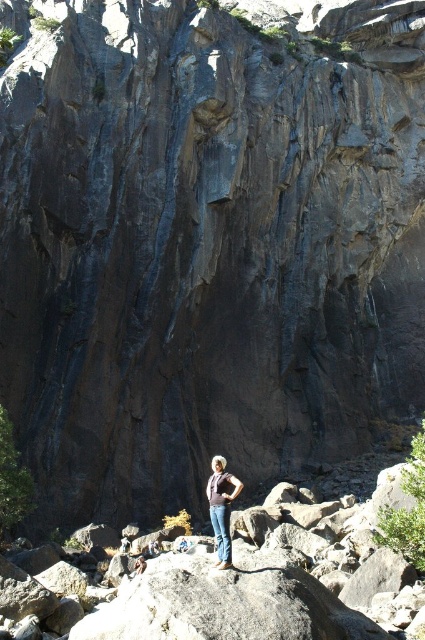
You are standing at the base of the towering rock face and want to find the point on the cliff that corresponds to the coordinates given. Which part of the cliff would the point at coordinates point (221, 508) be located?

The point at coordinates point (221, 508) is located on the denim pants at center, which belongs to the person standing on the rocks in the foreground.

Consider the image. You are a hiker who wants to ensure your clothing is properly layered before ascending the rocky terrain near the towering rock face. Are your denim pants at center covering your denim jeans at center?

The denim pants at center is positioned over denim jeans at center, so yes, the denim pants at center are covering the denim jeans at center.

You are a photographer trying to capture the entire scene of the towering rock face. You notice two objects labeled denim pants at center and denim jeans at center in the foreground. Which one should you adjust your camera angle to include both while maintaining the cliff as the main focus?

Since the denim pants at center is to the right of denim jeans at center, you should position your camera slightly to the left to ensure both objects are included without distracting from the cliff.